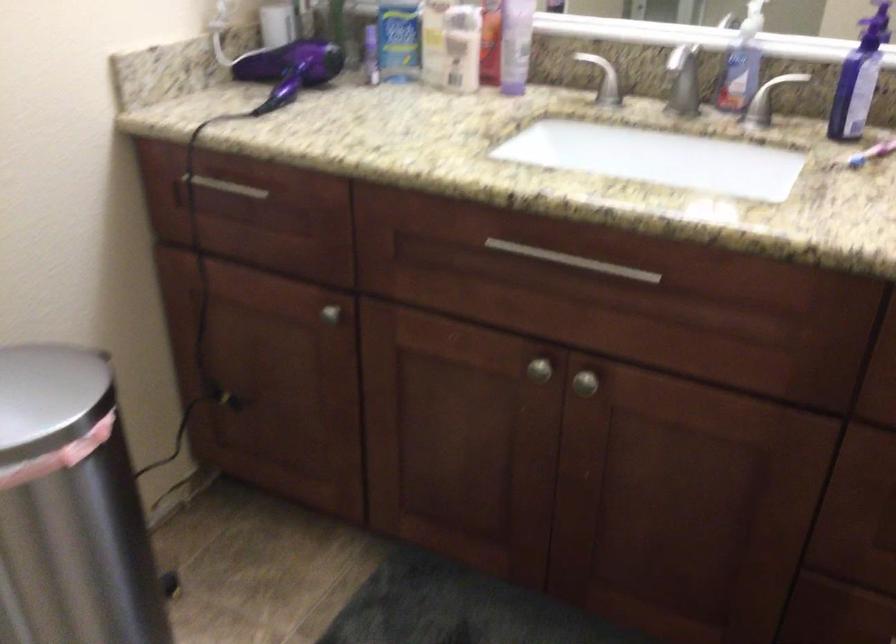
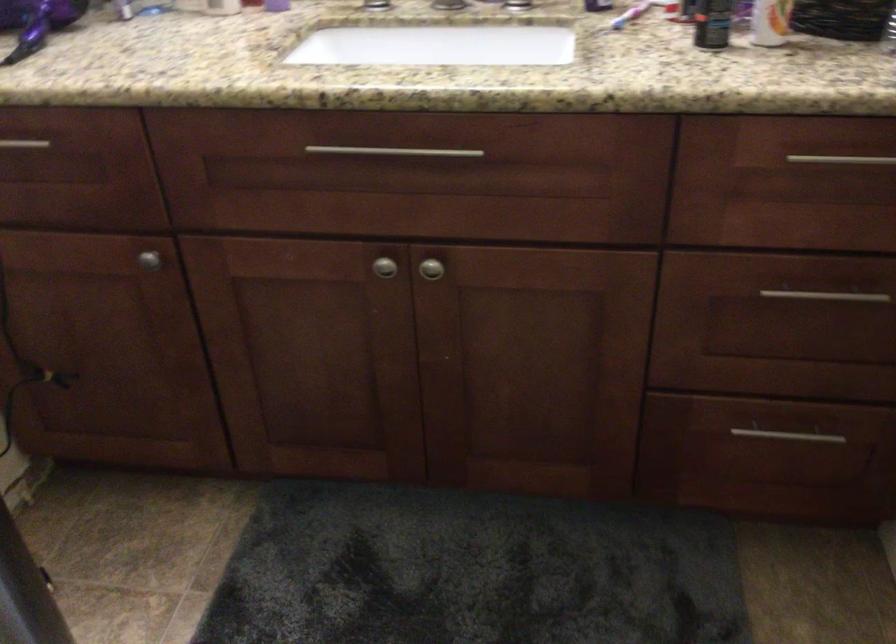
Locate, in the second image, the point that corresponds to (x=328, y=312) in the first image.

(149, 259)